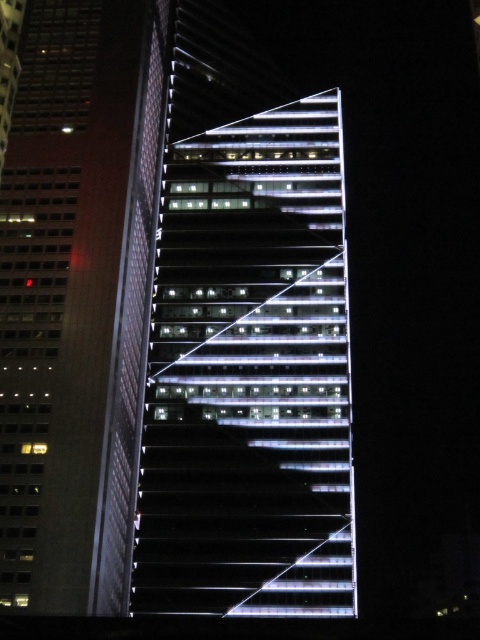
Which is more to the left, white glass building at center or matte glass skyscraper at left?

Positioned to the left is matte glass skyscraper at left.

Does white glass building at center have a greater height compared to matte glass skyscraper at left?

In fact, white glass building at center may be shorter than matte glass skyscraper at left.

Who is more distant from viewer, (171, 385) or (45, 609)?

Point (171, 385)

The image size is (480, 640). In order to click on white glass building at center in this screenshot , I will do `click(250, 376)`.